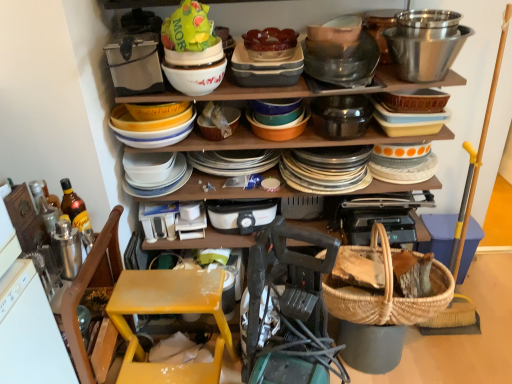
Locate an element on the screen. This screenshot has width=512, height=384. empty space that is ontop of woven wicker basket at lower right (from a real-world perspective) is located at coordinates (449, 226).